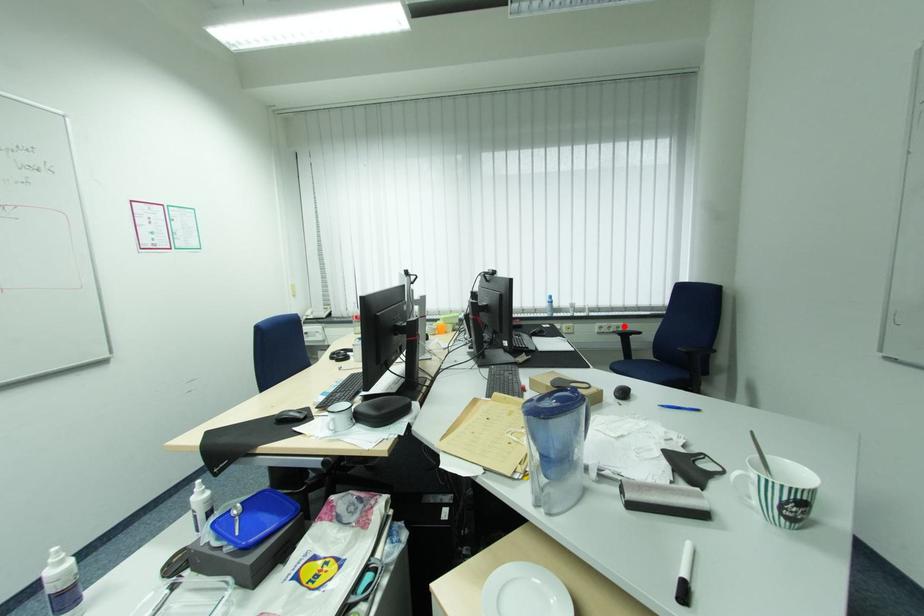
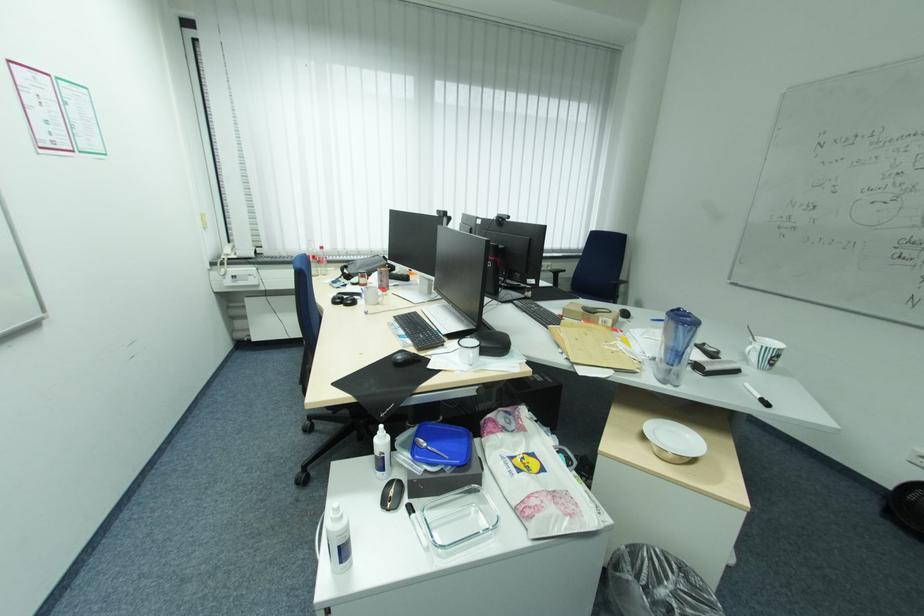
In the second image, find the point that corresponds to the highlighted location in the first image.

(554, 265)